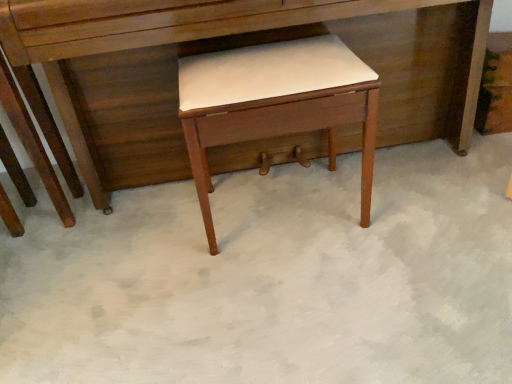
Image resolution: width=512 pixels, height=384 pixels. I want to click on free space in front of matte wood stool at center, so click(297, 295).